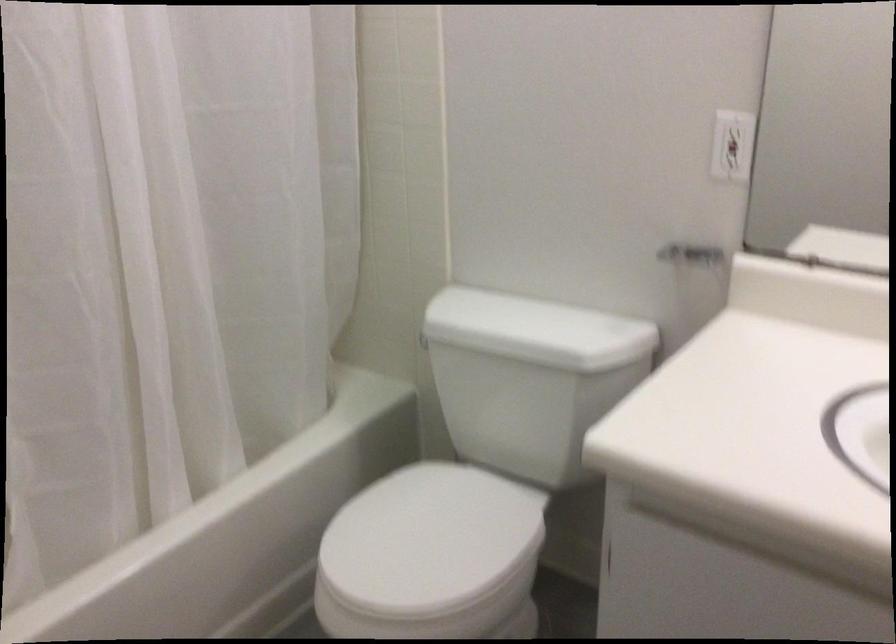
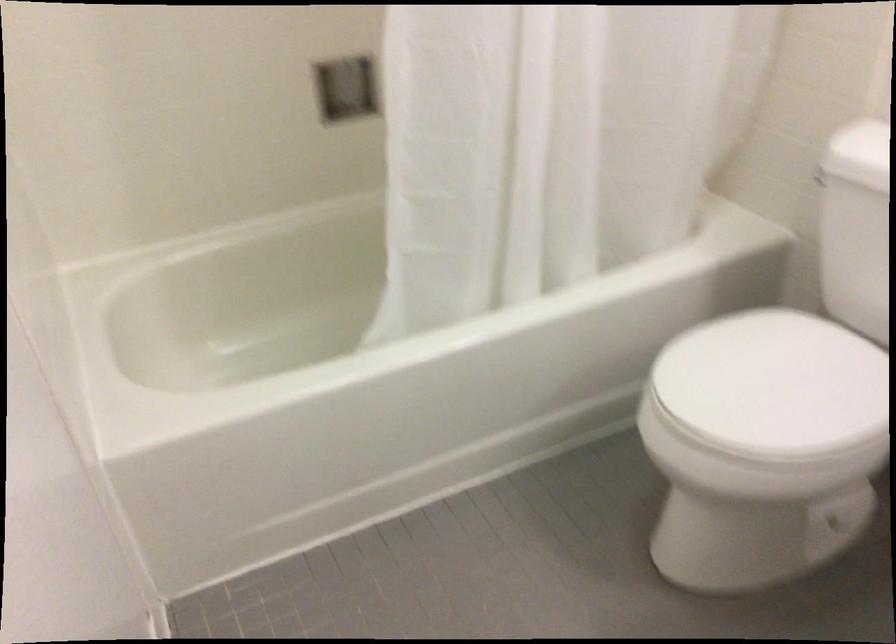
Question: The first image is from the beginning of the video and the second image is from the end. How did the camera likely rotate when shooting the video?

Choices:
 (A) Left
 (B) Right
 (C) Up
 (D) Down

Answer: (A)